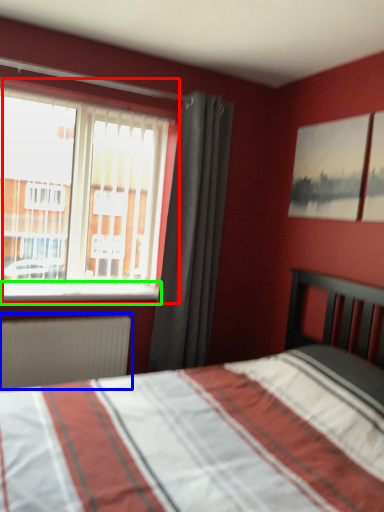
Question: Based on their relative distances, which object is nearer to window (highlighted by a red box)? Choose from radiator (highlighted by a blue box) and window sill (highlighted by a green box).

Choices:
 (A) radiator
 (B) window sill

Answer: (B)